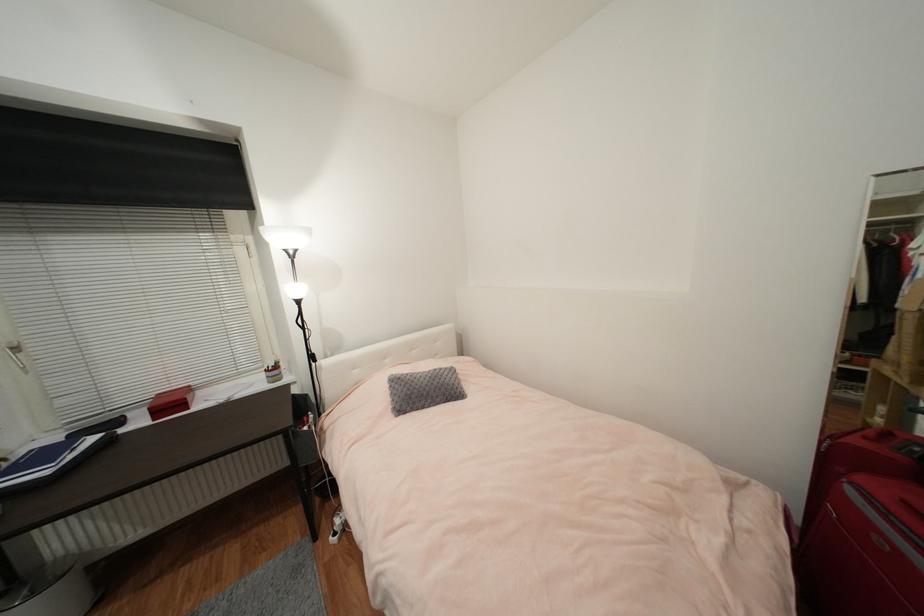
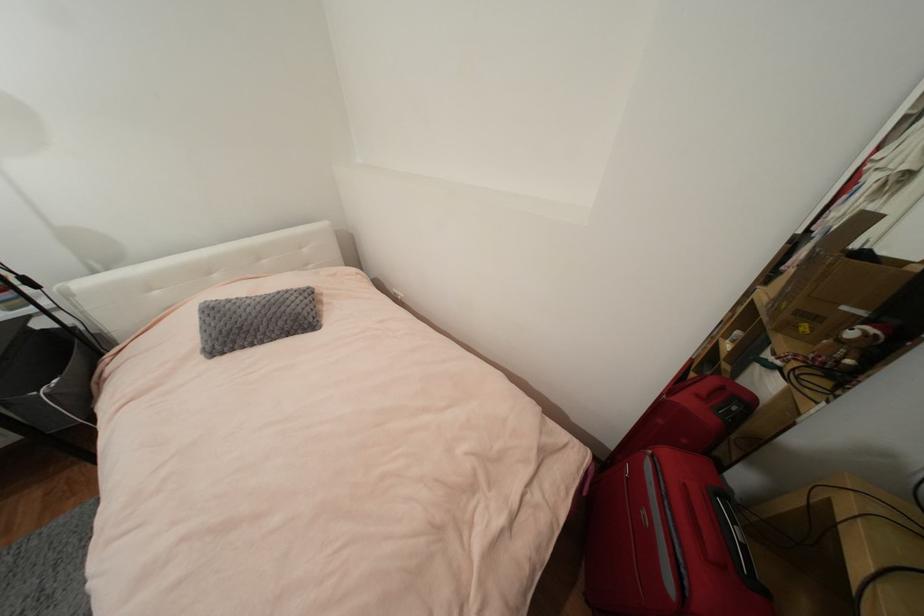
Question: Based on the continuous images, in which direction is the camera rotating? Reply with the corresponding letter.

Choices:
 (A) Left
 (B) Right
 (C) Up
 (D) Down

Answer: (D)